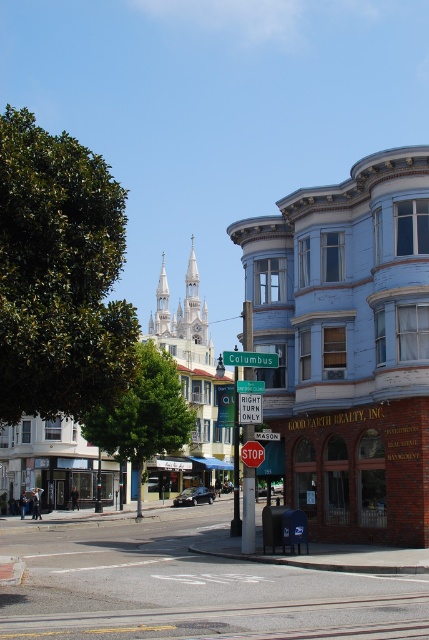
Question: Which of the following is the farthest from the observer?

Choices:
 (A) light blue wooden building at center
 (B) smooth asphalt road at center

Answer: (A)

Question: Can you confirm if light blue wooden building at center is smaller than smooth asphalt road at center?

Choices:
 (A) yes
 (B) no

Answer: (B)

Question: Which point is closer to the camera?

Choices:
 (A) light blue wooden building at center
 (B) smooth asphalt road at center

Answer: (B)

Question: Is light blue wooden building at center wider than smooth asphalt road at center?

Choices:
 (A) yes
 (B) no

Answer: (A)

Question: Is light blue wooden building at center positioned at the back of smooth asphalt road at center?

Choices:
 (A) no
 (B) yes

Answer: (B)